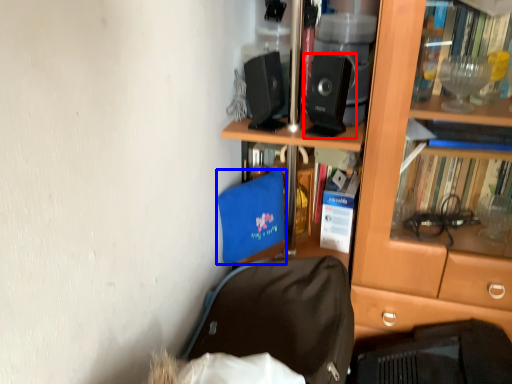
Question: Among these objects, which one is nearest to the camera, loudspeaker (highlighted by a red box) or luggage and bags (highlighted by a blue box)?

Choices:
 (A) loudspeaker
 (B) luggage and bags

Answer: (A)